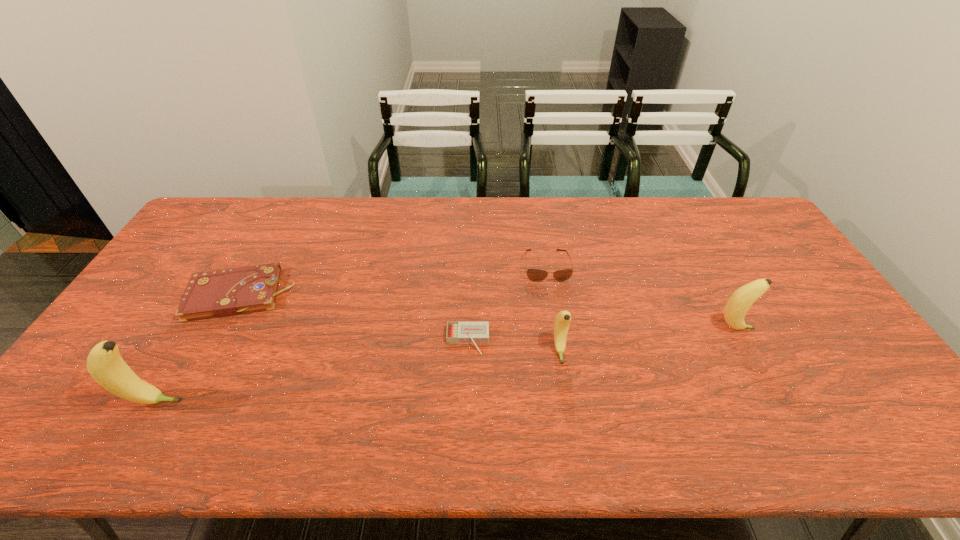
The height and width of the screenshot is (540, 960). Identify the location of free space that satisfies the following two spatial constraints: 1. on the front-facing side of the sunglasses; 2. from the stem of the leftmost banana. (568, 402).